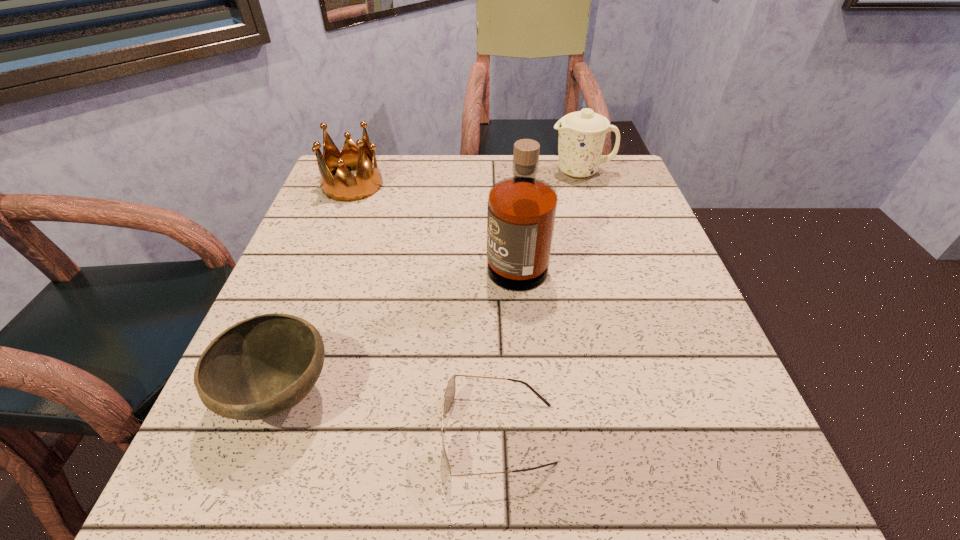
Identify which object is located as the second nearest to the sunglasses. Please provide its 2D coordinates. Your answer should be formatted as a tuple, i.e. [(x, y)], where the tuple contains the x and y coordinates of a point satisfying the conditions above.

[(521, 212)]